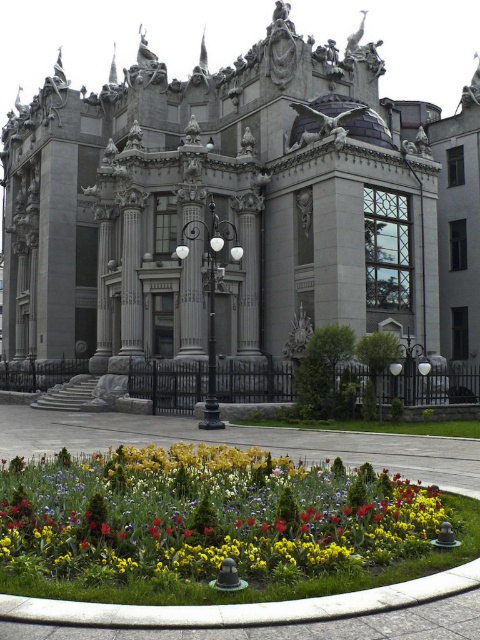
Question: Which object appears closest to the camera in this image?

Choices:
 (A) gray stone palace at center
 (B) yellow matte flowers at lower center

Answer: (B)

Question: Does gray stone palace at center have a smaller size compared to yellow matte flowers at lower center?

Choices:
 (A) yes
 (B) no

Answer: (B)

Question: Among these points, which one is nearest to the camera?

Choices:
 (A) (8, 538)
 (B) (253, 97)

Answer: (A)

Question: Is gray stone palace at center above yellow matte flowers at lower center?

Choices:
 (A) yes
 (B) no

Answer: (A)

Question: Does gray stone palace at center appear under yellow matte flowers at lower center?

Choices:
 (A) yes
 (B) no

Answer: (B)